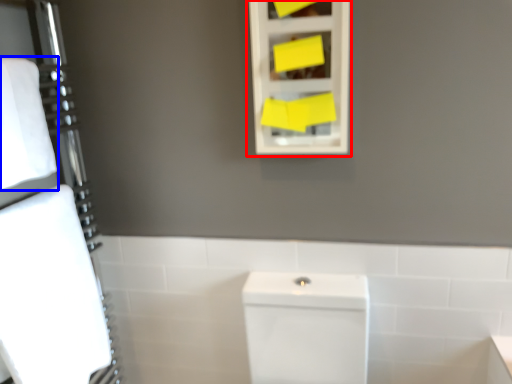
Question: Which object appears farthest to the camera in this image, medicine cabinet (highlighted by a red box) or bath towel (highlighted by a blue box)?

Choices:
 (A) medicine cabinet
 (B) bath towel

Answer: (A)